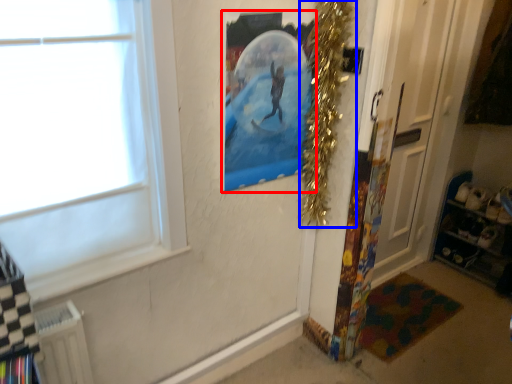
Question: Which of the following is the farthest to the observer, picture frame (highlighted by a red box) or christmas decoration (highlighted by a blue box)?

Choices:
 (A) picture frame
 (B) christmas decoration

Answer: (B)